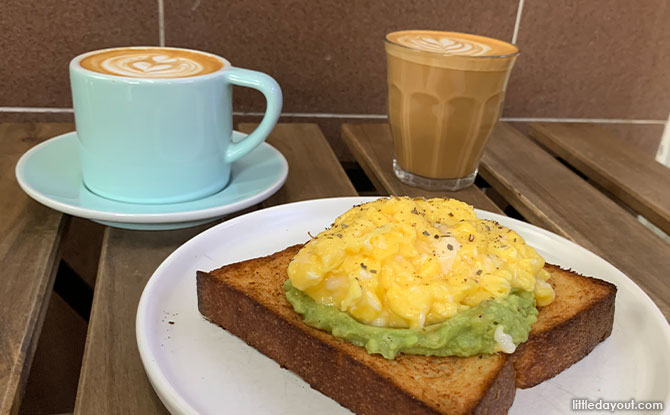
Find the location of a particular element. This screenshot has width=670, height=415. plate is located at coordinates (195, 315), (143, 212).